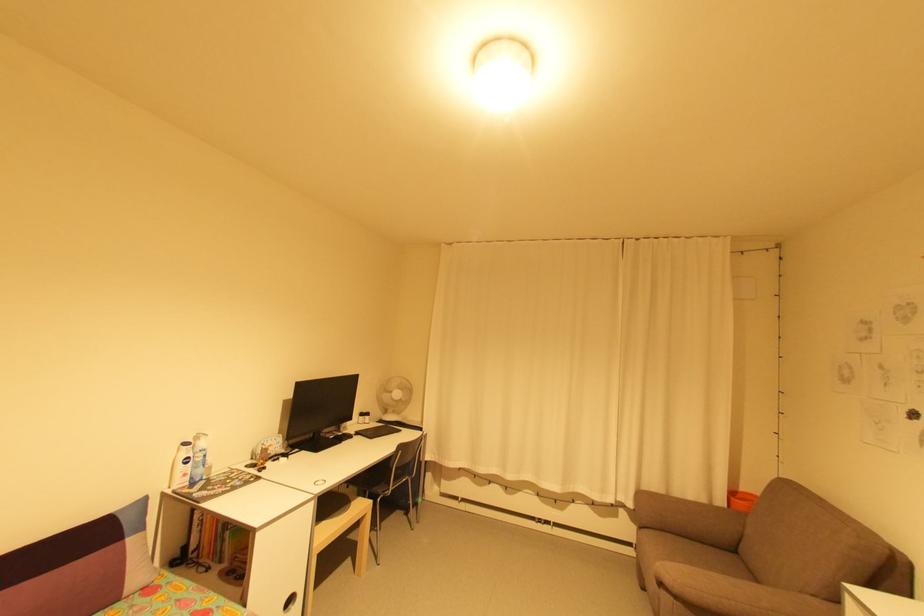
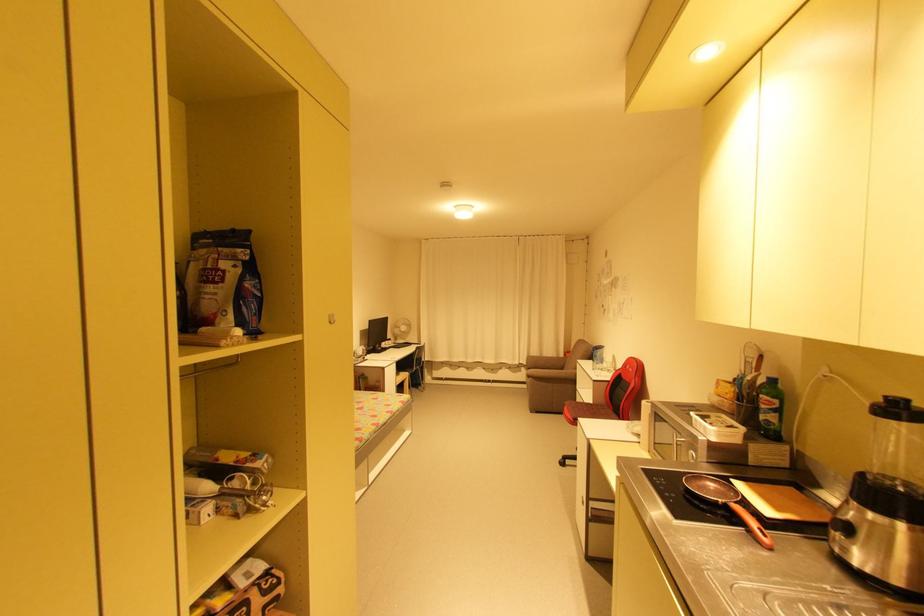
Locate, in the second image, the point that corresponds to (x=371, y=418) in the first image.

(395, 342)